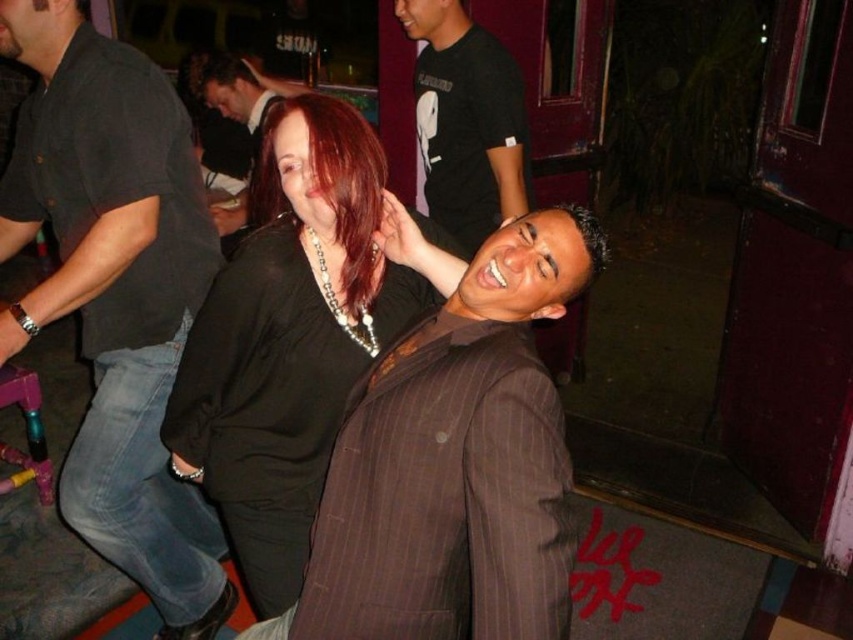
Question: Is black cotton t-shirt at upper center to the left of dark red hair at center from the viewer's perspective?

Choices:
 (A) yes
 (B) no

Answer: (B)

Question: Which object is positioned closest to the shiny black shirt at center?

Choices:
 (A) dark red hair at center
 (B) matte black shirt at upper center
 (C) black cotton t-shirt at upper center

Answer: (A)

Question: Does shiny black shirt at center have a larger size compared to matte black shirt at upper center?

Choices:
 (A) no
 (B) yes

Answer: (A)

Question: Is brown pinstripe suit at center thinner than shiny black shirt at center?

Choices:
 (A) yes
 (B) no

Answer: (A)

Question: Considering the real-world distances, which object is closest to the brown pinstripe suit at center?

Choices:
 (A) shiny black shirt at center
 (B) dark red hair at center

Answer: (A)

Question: Which point is farther to the camera?

Choices:
 (A) dark brown hair at upper left
 (B) shiny black shirt at center
 (C) dark gray shirt at center

Answer: (A)